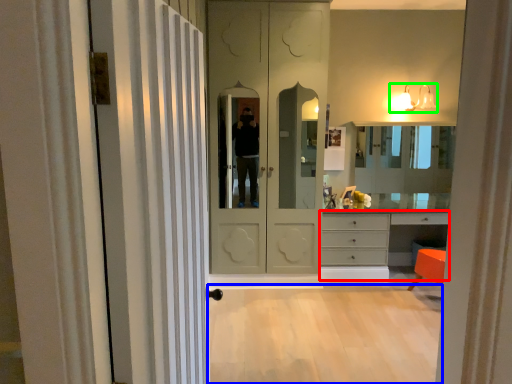
Question: Which is farther away from chest of drawers (highlighted by a red box)? plain (highlighted by a blue box) or light fixture (highlighted by a green box)?

Choices:
 (A) plain
 (B) light fixture

Answer: (B)